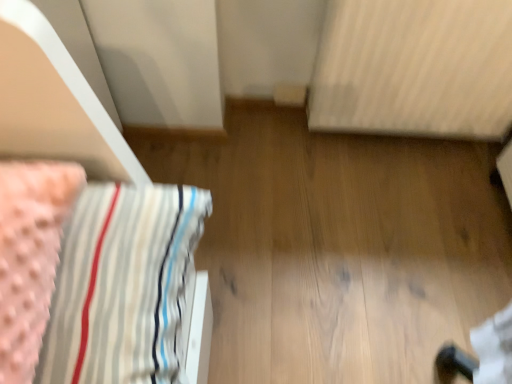
Question: Is point (3, 119) closer or farther from the camera than point (335, 16)?

Choices:
 (A) closer
 (B) farther

Answer: (A)

Question: From the image's perspective, relative to white textured radiator at upper right, is pink fabric at left above or below?

Choices:
 (A) above
 (B) below

Answer: (B)

Question: Relative to white textured radiator at upper right, is pink fabric at left in front or behind?

Choices:
 (A) behind
 (B) front

Answer: (B)

Question: Would you say white textured radiator at upper right is inside or outside pink fabric at left?

Choices:
 (A) outside
 (B) inside

Answer: (A)

Question: Considering the positions of white textured radiator at upper right and pink fabric at left in the image, is white textured radiator at upper right wider or thinner than pink fabric at left?

Choices:
 (A) wide
 (B) thin

Answer: (B)

Question: In terms of height, does white textured radiator at upper right look taller or shorter compared to pink fabric at left?

Choices:
 (A) short
 (B) tall

Answer: (B)

Question: Looking at the image, does white textured radiator at upper right seem bigger or smaller compared to pink fabric at left?

Choices:
 (A) big
 (B) small

Answer: (A)